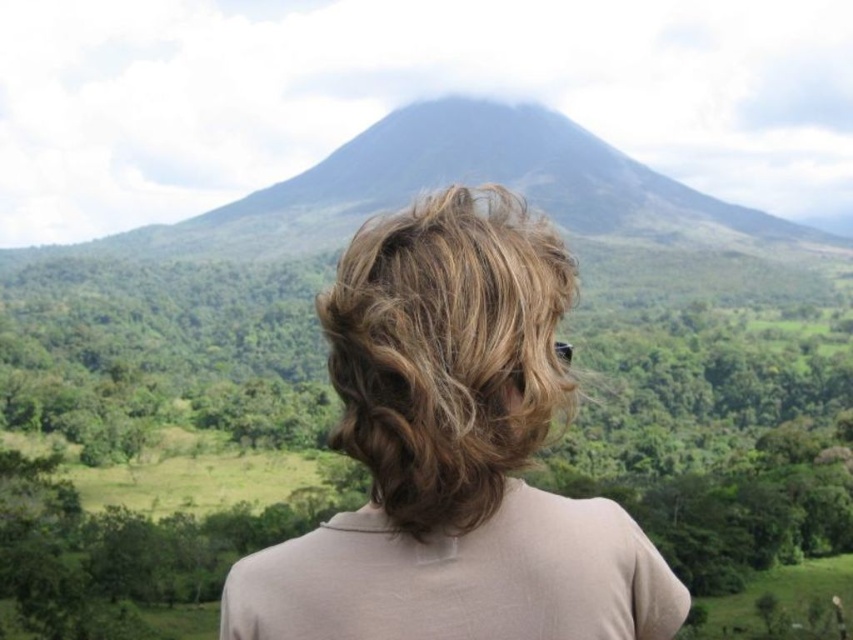
Which is more to the left, blonde hair at center or blonde curly hair at center?

blonde curly hair at center

Is blonde hair at center bigger than blonde curly hair at center?

Yes, blonde hair at center is bigger than blonde curly hair at center.

Describe the element at coordinates (453, 452) in the screenshot. I see `blonde hair at center` at that location.

Find the location of a particular element. blonde hair at center is located at coordinates [453, 452].